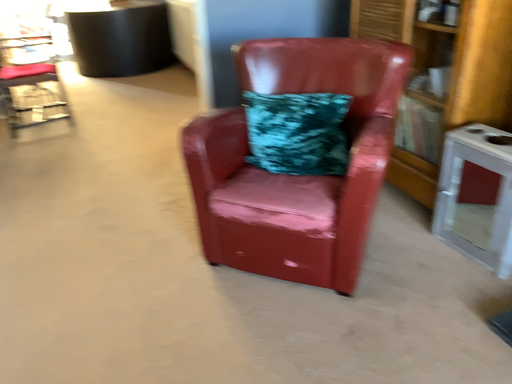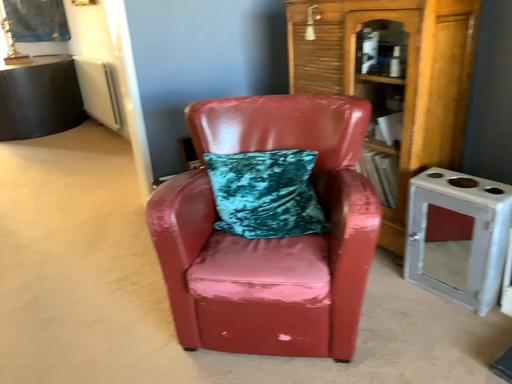
Question: How did the camera likely rotate when shooting the video?

Choices:
 (A) rotated left
 (B) rotated right

Answer: (B)